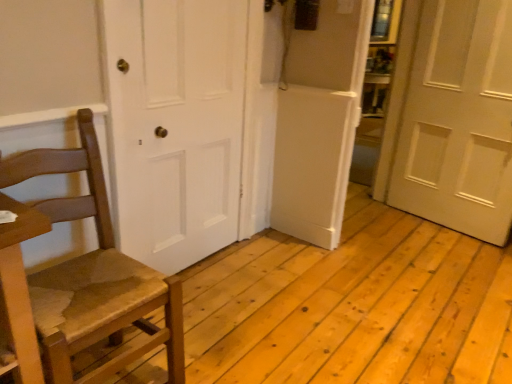
The image size is (512, 384). In order to click on free space that is in between white matte door at right, the second door in the left-to-right sequence, and white matte door at center, which is counted as the 1th door, starting from the left in this screenshot , I will do `click(349, 250)`.